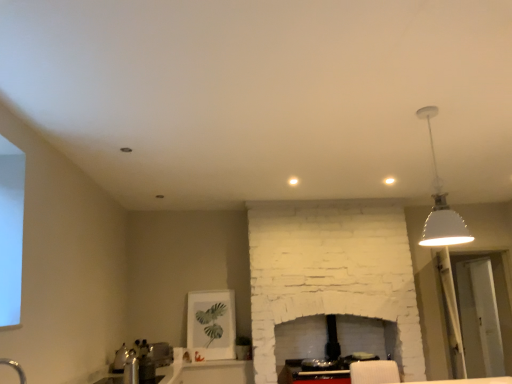
In order to face satin silver toaster at lower left, should I rotate leftwards or rightwards?

Turn left by 12.752 degrees to look at satin silver toaster at lower left.

At what (x,y) coordinates should I click in order to perform the action: click on white matte lampshade at upper right. Please return your answer as a coordinate pair (x, y). Looking at the image, I should click on (441, 205).

The width and height of the screenshot is (512, 384). What do you see at coordinates (131, 368) in the screenshot?
I see `silver metallic faucet at lower left` at bounding box center [131, 368].

What do you see at coordinates (479, 318) in the screenshot?
I see `transparent glass door at right` at bounding box center [479, 318].

The image size is (512, 384). Find the location of `satin silver toaster at lower left`. satin silver toaster at lower left is located at coordinates [161, 353].

This screenshot has width=512, height=384. I want to click on lamp above the satin silver toaster at lower left (from a real-world perspective), so click(441, 205).

From the picture: Considering the relative positions of satin silver toaster at lower left and white matte lampshade at upper right in the image provided, is satin silver toaster at lower left to the left or to the right of white matte lampshade at upper right?

Clearly, satin silver toaster at lower left is on the left of white matte lampshade at upper right in the image.

Is satin silver toaster at lower left in front of or behind white matte lampshade at upper right in the image?

Visually, satin silver toaster at lower left is located behind white matte lampshade at upper right.

How distant is satin silver toaster at lower left from white matte lampshade at upper right?

3.13 meters.

Is point (125, 379) closer or farther from the camera than point (439, 205)?

Clearly, point (125, 379) is more distant from the camera than point (439, 205).

Are silver metallic faucet at lower left and white matte lampshade at upper right beside each other?

silver metallic faucet at lower left and white matte lampshade at upper right are not in contact.

Looking at their sizes, would you say silver metallic faucet at lower left is wider or thinner than white matte lampshade at upper right?

silver metallic faucet at lower left is thinner than white matte lampshade at upper right.

You are a GUI agent. You are given a task and a screenshot of the screen. Output one action in this format:
    pyautogui.click(x=<x>, y=<y>)
    Task: Click on the lamp to the left of transparent glass door at right
    This screenshot has height=384, width=512.
    Given the screenshot: What is the action you would take?
    (x=441, y=205)

Considering their positions, is white matte lampshade at upper right located in front of or behind transparent glass door at right?

In the image, white matte lampshade at upper right appears in front of transparent glass door at right.

Looking at their sizes, would you say white matte lampshade at upper right is wider or thinner than transparent glass door at right?

Considering their sizes, white matte lampshade at upper right looks broader than transparent glass door at right.

Is silver metallic faucet at lower left facing towards satin silver toaster at lower left?

No, silver metallic faucet at lower left is not oriented towards satin silver toaster at lower left.

Would you say silver metallic faucet at lower left is a long distance from satin silver toaster at lower left?

No.

Who is more distant, silver metallic faucet at lower left or satin silver toaster at lower left?

satin silver toaster at lower left.

Is silver metallic faucet at lower left to the left or to the right of satin silver toaster at lower left in the image?

Based on their positions, silver metallic faucet at lower left is located to the right of satin silver toaster at lower left.

Is white matte lampshade at upper right placed right next to satin silver toaster at lower left?

There is a gap between white matte lampshade at upper right and satin silver toaster at lower left.

In the image, there is a satin silver toaster at lower left. Where is `lamp above it (from the image's perspective)`? The image size is (512, 384). lamp above it (from the image's perspective) is located at coordinates (441, 205).

Is white matte lampshade at upper right positioned with its back to satin silver toaster at lower left?

No, white matte lampshade at upper right is not facing the opposite direction of satin silver toaster at lower left.

From the image's perspective, which object appears higher, silver metallic faucet at lower left or transparent glass door at right?

silver metallic faucet at lower left.

Is transparent glass door at right completely or partially inside silver metallic faucet at lower left?

No, transparent glass door at right is not surrounded by silver metallic faucet at lower left.

Can you tell me how much silver metallic faucet at lower left and transparent glass door at right differ in facing direction?

The facing directions of silver metallic faucet at lower left and transparent glass door at right are 177 degrees apart.

Is transparent glass door at right located outside white matte lampshade at upper right?

Yes, transparent glass door at right is not within white matte lampshade at upper right.

Which is more to the right, transparent glass door at right or white matte lampshade at upper right?

Positioned to the right is transparent glass door at right.

Does point (477, 264) come behind point (441, 233)?

Yes.

From a real-world perspective, is transparent glass door at right located beneath white matte lampshade at upper right?

Correct, in the physical world, transparent glass door at right is lower than white matte lampshade at upper right.

Identify the location of appliance located below the white matte lampshade at upper right (from the image's perspective). (161, 353).

At what (x,y) coordinates should I click in order to perform the action: click on faucet to the left of white matte lampshade at upper right. Please return your answer as a coordinate pair (x, y). The image size is (512, 384). Looking at the image, I should click on (131, 368).

Based on their spatial positions, is transparent glass door at right or silver metallic faucet at lower left closer to white matte lampshade at upper right?

silver metallic faucet at lower left is closer to white matte lampshade at upper right.

Estimate the real-world distances between objects in this image. Which object is further from silver metallic faucet at lower left, white matte lampshade at upper right or satin silver toaster at lower left?

white matte lampshade at upper right is further to silver metallic faucet at lower left.

Considering their positions, is silver metallic faucet at lower left positioned further to transparent glass door at right than white matte lampshade at upper right?

Among the two, silver metallic faucet at lower left is located further to transparent glass door at right.

From the image, which object appears to be nearer to white matte lampshade at upper right, silver metallic faucet at lower left or satin silver toaster at lower left?

Among the two, silver metallic faucet at lower left is located nearer to white matte lampshade at upper right.

From the image, which object appears to be nearer to transparent glass door at right, silver metallic faucet at lower left or satin silver toaster at lower left?

Among the two, satin silver toaster at lower left is located nearer to transparent glass door at right.

Looking at the image, which one is located further to satin silver toaster at lower left, white matte lampshade at upper right or silver metallic faucet at lower left?

white matte lampshade at upper right.

Considering their positions, is silver metallic faucet at lower left positioned further to satin silver toaster at lower left than white matte lampshade at upper right?

white matte lampshade at upper right is further to satin silver toaster at lower left.

Considering their positions, is satin silver toaster at lower left positioned closer to white matte lampshade at upper right than transparent glass door at right?

transparent glass door at right.

The width and height of the screenshot is (512, 384). Identify the location of faucet between satin silver toaster at lower left and transparent glass door at right. (131, 368).

Find the location of a particular element. This screenshot has width=512, height=384. lamp between silver metallic faucet at lower left and transparent glass door at right from left to right is located at coordinates (441, 205).

Find the location of a particular element. Image resolution: width=512 pixels, height=384 pixels. lamp located between satin silver toaster at lower left and transparent glass door at right in the left-right direction is located at coordinates pos(441,205).

In order to click on faucet between satin silver toaster at lower left and white matte lampshade at upper right from left to right in this screenshot , I will do `click(131, 368)`.